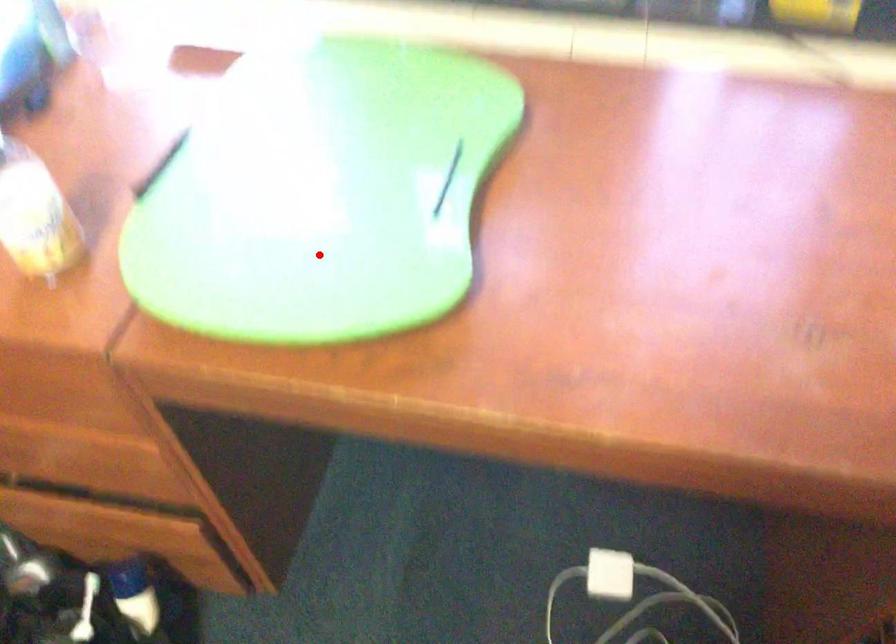
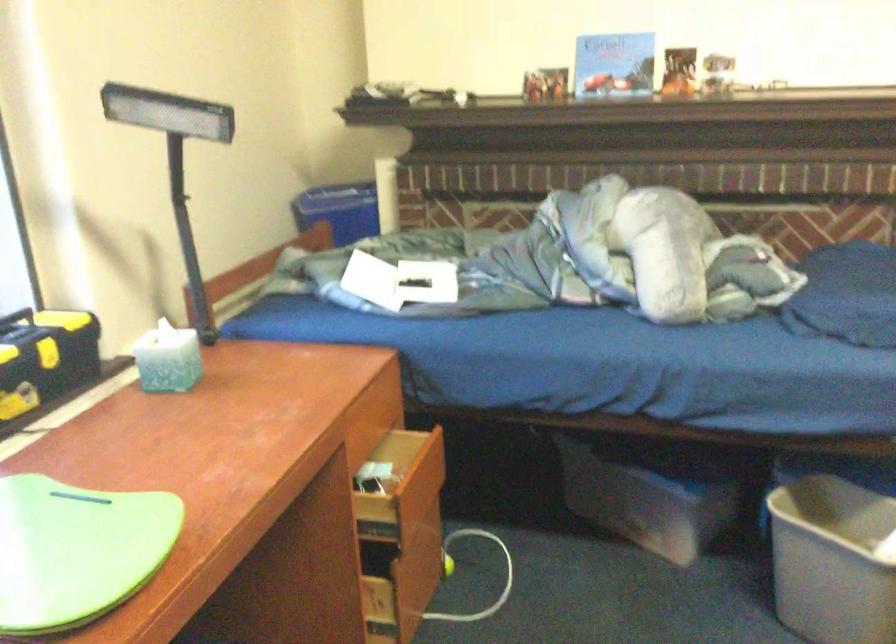
Question: I am providing you with two images of the same scene from different viewpoints. Image1 has a red point marked. In image2, the corresponding 3D location appears at what relative position? Reply with the corresponding letter.

Choices:
 (A) Closer
 (B) Farther

Answer: (B)